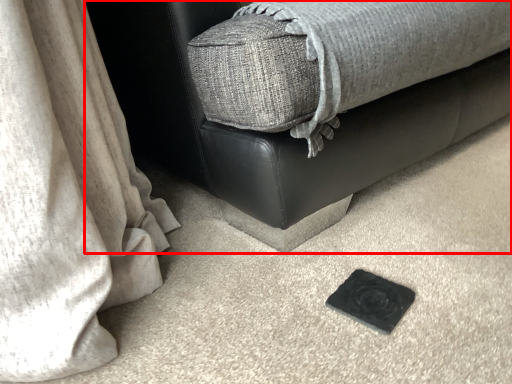
Question: From the image, what is the correct spatial relationship of furniture (annotated by the red box) in relation to pad?

Choices:
 (A) right
 (B) left

Answer: (A)